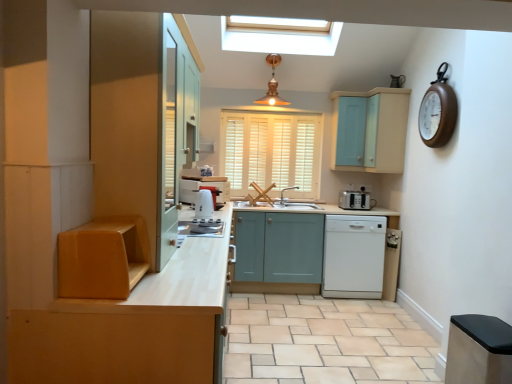
Image resolution: width=512 pixels, height=384 pixels. I want to click on copper/textured pendant light at upper center, so click(272, 85).

I want to click on matte yellow cabinet at left, placed as the 5th cabinetry when sorted from right to left, so click(x=103, y=258).

Is copper/textured pendant light at upper center directly adjacent to matte yellow cabinet at left, placed as the 5th cabinetry when sorted from right to left?

copper/textured pendant light at upper center and matte yellow cabinet at left, placed as the 5th cabinetry when sorted from right to left, are clearly separated.

Which of these two, copper/textured pendant light at upper center or matte yellow cabinet at left, placed as the 5th cabinetry when sorted from right to left, is smaller?

With smaller size is matte yellow cabinet at left, placed as the 5th cabinetry when sorted from right to left.

From a real-world perspective, is copper/textured pendant light at upper center positioned above or below matte yellow cabinet at left, placed as the 5th cabinetry when sorted from right to left?

In terms of real-world spatial position, copper/textured pendant light at upper center is above matte yellow cabinet at left, placed as the 5th cabinetry when sorted from right to left.

What are the coordinates of `the 2nd cabinetry counting from the left side of the copper/textured pendant light at upper center` in the screenshot? It's located at coord(103,258).

Looking at this image, is satin silver toaster at center outside of light blue wood cabinet at upper right, placed as the 1th cabinetry when sorted from right to left?

That's correct, satin silver toaster at center is outside of light blue wood cabinet at upper right, placed as the 1th cabinetry when sorted from right to left.

Is light blue wood cabinet at upper right, placed as the 1th cabinetry when sorted from right to left, at the back of satin silver toaster at center?

A: No, light blue wood cabinet at upper right, placed as the 1th cabinetry when sorted from right to left, is not at the back of satin silver toaster at center.

Consider the image. Are satin silver toaster at center and light blue wood cabinet at upper right, the 5th cabinetry positioned from the left, beside each other?

satin silver toaster at center and light blue wood cabinet at upper right, the 5th cabinetry positioned from the left, are clearly separated.

Is satin silver toaster at center to the left of light blue wood cabinet at upper right, placed as the 1th cabinetry when sorted from right to left, from the viewer's perspective?

Yes, satin silver toaster at center is to the left of light blue wood cabinet at upper right, placed as the 1th cabinetry when sorted from right to left.

From the image's perspective, is matte yellow cabinet at left, the first cabinetry viewed from the left, over stainless steel trash can at lower right, which ranks as the second cabinetry in right-to-left order?

Correct, matte yellow cabinet at left, the first cabinetry viewed from the left, appears higher than stainless steel trash can at lower right, which ranks as the second cabinetry in right-to-left order, in the image.

From the picture: Which point is more distant from viewer, [85,236] or [463,357]?

Point [463,357]

Is matte yellow cabinet at left, the first cabinetry viewed from the left, positioned beyond the bounds of stainless steel trash can at lower right, the fourth cabinetry from the left?

Absolutely, matte yellow cabinet at left, the first cabinetry viewed from the left, is external to stainless steel trash can at lower right, the fourth cabinetry from the left.

Which of these two, matte yellow cabinet at left, the first cabinetry viewed from the left, or stainless steel trash can at lower right, the fourth cabinetry from the left, is bigger?

stainless steel trash can at lower right, the fourth cabinetry from the left.

From the image's perspective, which object appears higher, white glossy dishwasher at lower center or light blue wood cabinet at upper right, the 5th cabinetry positioned from the left?

light blue wood cabinet at upper right, the 5th cabinetry positioned from the left, from the image's perspective.

Would you say white glossy dishwasher at lower center is a long distance from light blue wood cabinet at upper right, placed as the 1th cabinetry when sorted from right to left?

That's not correct — white glossy dishwasher at lower center is a little close to light blue wood cabinet at upper right, placed as the 1th cabinetry when sorted from right to left.

From a real-world perspective, is white glossy dishwasher at lower center physically above light blue wood cabinet at upper right, the 5th cabinetry positioned from the left?

Incorrect, from a real-world perspective, white glossy dishwasher at lower center is lower than light blue wood cabinet at upper right, the 5th cabinetry positioned from the left.

Does white glossy dishwasher at lower center have a greater width compared to light blue wood cabinet at upper right, placed as the 1th cabinetry when sorted from right to left?

Correct, the width of white glossy dishwasher at lower center exceeds that of light blue wood cabinet at upper right, placed as the 1th cabinetry when sorted from right to left.

Is matte yellow cabinet at left, the first cabinetry viewed from the left, oriented away from white plastic toaster at right?

That's not correct — matte yellow cabinet at left, the first cabinetry viewed from the left, is not looking away from white plastic toaster at right.

Would you say matte yellow cabinet at left, the first cabinetry viewed from the left, is outside white plastic toaster at right?

That's correct, matte yellow cabinet at left, the first cabinetry viewed from the left, is outside of white plastic toaster at right.

Looking at this image, is the position of matte yellow cabinet at left, placed as the 5th cabinetry when sorted from right to left, more distant than that of white plastic toaster at right?

No, matte yellow cabinet at left, placed as the 5th cabinetry when sorted from right to left, is closer to the viewer.

Find the location of a particular element. Image resolution: width=512 pixels, height=384 pixels. light fixture that is on the left side of matte teal cabinet at center, acting as the 3th cabinetry starting from the left is located at coordinates (272, 85).

Looking at this image, between matte teal cabinet at center, which is the third cabinetry in right-to-left order, and copper/textured pendant light at upper center, which one is positioned behind?

matte teal cabinet at center, which is the third cabinetry in right-to-left order, is further away from the camera.

Is there a large distance between matte teal cabinet at center, which is the third cabinetry in right-to-left order, and copper/textured pendant light at upper center?

matte teal cabinet at center, which is the third cabinetry in right-to-left order, is far away from copper/textured pendant light at upper center.

Between beige tile at lower right and white glossy dishwasher at lower center, which one has larger size?

With larger size is white glossy dishwasher at lower center.

From the image's perspective, is beige tile at lower right above or below white glossy dishwasher at lower center?

From the image's perspective, beige tile at lower right appears below white glossy dishwasher at lower center.

Is beige tile at lower right closer to the viewer compared to white glossy dishwasher at lower center?

Yes, the depth of beige tile at lower right is less than that of white glossy dishwasher at lower center.

Is beige tile at lower right oriented away from white glossy dishwasher at lower center?

beige tile at lower right does not have its back to white glossy dishwasher at lower center.

From the image's perspective, which cabinetry is the 2nd one below the copper/textured pendant light at upper center? Please provide its 2D coordinates.

[(103, 258)]

In the image, there is a light blue wood cabinet at upper right, placed as the 1th cabinetry when sorted from right to left. What are the coordinates of `appliance below it (from a real-world perspective)` in the screenshot? It's located at (201, 228).

From the image, which object appears to be farther from matte wood cabinet at left, placed as the second cabinetry when sorted from left to right, wooden clock at upper right or white glossy dishwasher at lower center?

The object further to matte wood cabinet at left, placed as the second cabinetry when sorted from left to right, is white glossy dishwasher at lower center.

Estimate the real-world distances between objects in this image. Which object is further from copper/textured pendant light at upper center, white glossy dishwasher at lower center or matte teal cabinet at center, acting as the 3th cabinetry starting from the left?

Based on the image, white glossy dishwasher at lower center appears to be further to copper/textured pendant light at upper center.

Based on their spatial positions, is matte teal cabinet at center, which is the third cabinetry in right-to-left order, or white glossy dishwasher at lower center closer to satin silver toaster at center?

matte teal cabinet at center, which is the third cabinetry in right-to-left order.

Looking at the image, which one is located closer to beige tile at lower right, matte teal cabinet at center, which is the third cabinetry in right-to-left order, or white glossy dishwasher at lower center?

white glossy dishwasher at lower center lies closer to beige tile at lower right than the other object.

Which object lies further to the anchor point beige tile at lower right, light blue wood cabinet at upper right, placed as the 1th cabinetry when sorted from right to left, or matte yellow cabinet at left, placed as the 5th cabinetry when sorted from right to left?

Based on the image, matte yellow cabinet at left, placed as the 5th cabinetry when sorted from right to left, appears to be further to beige tile at lower right.

Which object lies further to the anchor point satin silver toaster at center, matte wood cabinet at left, marked as the fourth cabinetry in a right-to-left arrangement, or matte teal cabinet at center, acting as the 3th cabinetry starting from the left?

matte teal cabinet at center, acting as the 3th cabinetry starting from the left, lies further to satin silver toaster at center than the other object.

Based on their spatial positions, is copper/textured pendant light at upper center or stainless steel trash can at lower right, which ranks as the second cabinetry in right-to-left order, further from matte wood cabinet at left, placed as the second cabinetry when sorted from left to right?

Based on the image, copper/textured pendant light at upper center appears to be further to matte wood cabinet at left, placed as the second cabinetry when sorted from left to right.

Estimate the real-world distances between objects in this image. Which object is closer to light blue wood cabinet at upper right, placed as the 1th cabinetry when sorted from right to left, wooden clock at upper right or copper/textured pendant light at upper center?

wooden clock at upper right is closer to light blue wood cabinet at upper right, placed as the 1th cabinetry when sorted from right to left.

Find the location of a particular element. This screenshot has height=384, width=512. tile between stainless steel trash can at lower right, which ranks as the second cabinetry in right-to-left order, and white plastic toaster at right from front to back is located at coordinates (324, 341).

Find the location of a particular element. This screenshot has height=384, width=512. appliance between matte yellow cabinet at left, placed as the 5th cabinetry when sorted from right to left, and white wood blinds at center in the front-back direction is located at coordinates (201, 228).

The image size is (512, 384). Find the location of `appliance between copper/textured pendant light at upper center and matte teal cabinet at center, which is the third cabinetry in right-to-left order, from top to bottom`. appliance between copper/textured pendant light at upper center and matte teal cabinet at center, which is the third cabinetry in right-to-left order, from top to bottom is located at coordinates (201, 228).

The width and height of the screenshot is (512, 384). In order to click on light fixture between stainless steel trash can at lower right, which ranks as the second cabinetry in right-to-left order, and white plastic toaster at right, along the z-axis in this screenshot , I will do `click(272, 85)`.